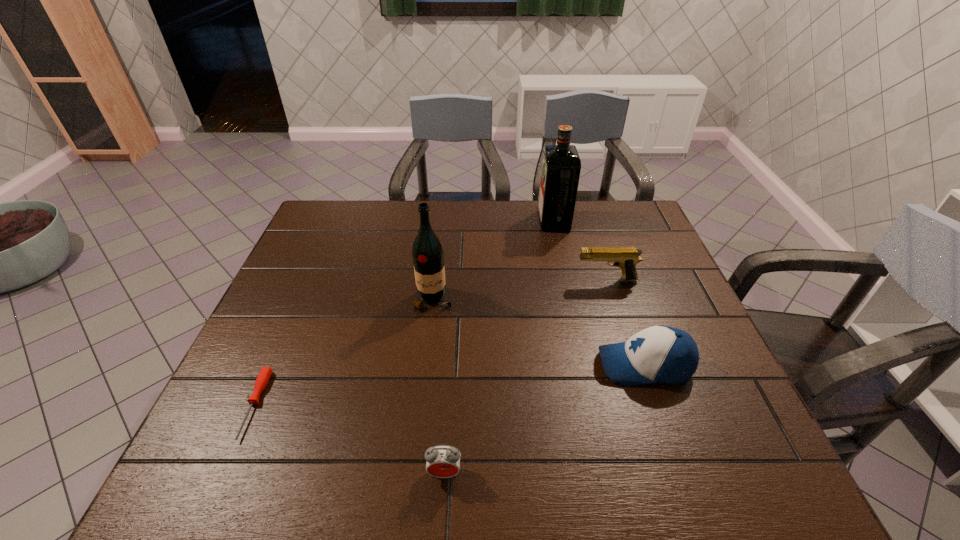
The image size is (960, 540). I want to click on baseball cap positioned at the right edge, so click(x=661, y=354).

Locate an element on the screen. pistol that is at the right edge is located at coordinates (626, 258).

Where is `vacant space at the far edge of the desktop`? The height and width of the screenshot is (540, 960). vacant space at the far edge of the desktop is located at coordinates (587, 218).

The height and width of the screenshot is (540, 960). Find the location of `vacant region at the near edge of the desktop`. vacant region at the near edge of the desktop is located at coordinates (274, 491).

The width and height of the screenshot is (960, 540). In the image, there is a desktop. What are the coordinates of `free space at the left edge` in the screenshot? It's located at (295, 320).

Locate an element on the screen. vacant point at the right edge is located at coordinates (636, 246).

You are a GUI agent. You are given a task and a screenshot of the screen. Output one action in this format:
    pyautogui.click(x=<x>, y=<y>)
    Task: Click on the vacant area at the far left corner
    
    Given the screenshot: What is the action you would take?
    pyautogui.click(x=324, y=238)

Locate an element on the screen. The height and width of the screenshot is (540, 960). vacant space at the near left corner of the desktop is located at coordinates (222, 490).

Where is `blank area at the far right corner`? This screenshot has height=540, width=960. blank area at the far right corner is located at coordinates (632, 211).

The height and width of the screenshot is (540, 960). In the image, there is a desktop. Find the location of `vacant area at the near right corner`. vacant area at the near right corner is located at coordinates (712, 458).